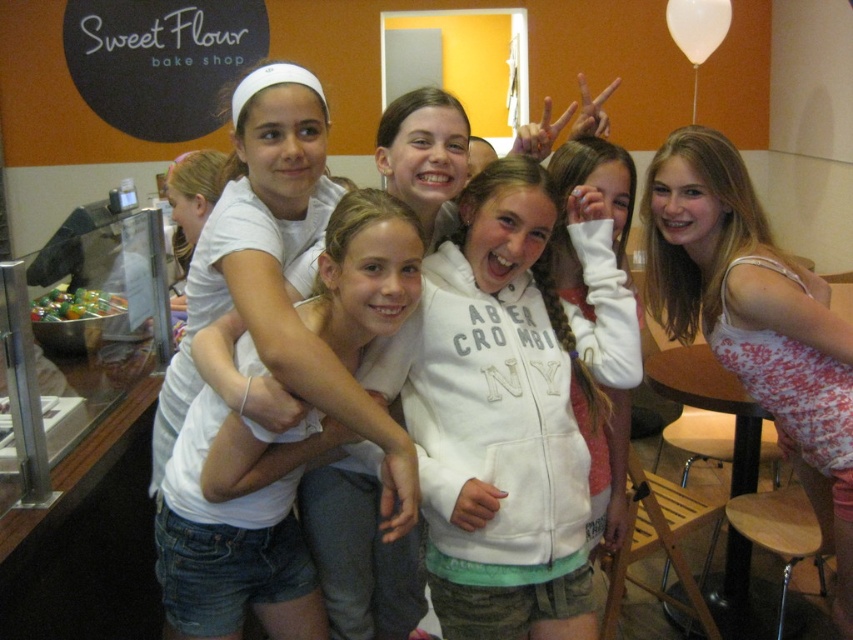
Between pink floral tank top at right and jeans at center, which one has more height?

With more height is pink floral tank top at right.

Between pink floral tank top at right and jeans at center, which one has less height?

jeans at center is shorter.

Which is in front, point (660, 216) or point (216, 609)?

Positioned in front is point (216, 609).

Where is `pink floral tank top at right`? The width and height of the screenshot is (853, 640). pink floral tank top at right is located at coordinates (753, 321).